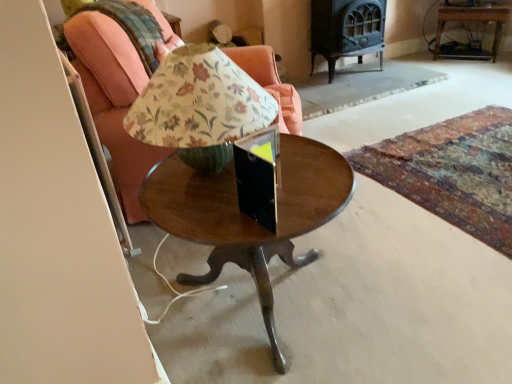
Question: Is wooden side table at upper right at the right side of wooden round table at center?

Choices:
 (A) yes
 (B) no

Answer: (A)

Question: Considering the relative sizes of wooden side table at upper right and wooden round table at center in the image provided, is wooden side table at upper right taller than wooden round table at center?

Choices:
 (A) no
 (B) yes

Answer: (A)

Question: Does wooden side table at upper right have a larger size compared to wooden round table at center?

Choices:
 (A) no
 (B) yes

Answer: (A)

Question: Is wooden round table at center surrounded by wooden side table at upper right?

Choices:
 (A) no
 (B) yes

Answer: (A)

Question: Is there a large distance between wooden side table at upper right and wooden round table at center?

Choices:
 (A) yes
 (B) no

Answer: (A)

Question: Would you say wooden round table at center is inside or outside wooden side table at upper right?

Choices:
 (A) inside
 (B) outside

Answer: (B)

Question: Considering the positions of wooden round table at center and wooden side table at upper right in the image, is wooden round table at center taller or shorter than wooden side table at upper right?

Choices:
 (A) tall
 (B) short

Answer: (A)

Question: Relative to wooden side table at upper right, is wooden round table at center in front or behind?

Choices:
 (A) behind
 (B) front

Answer: (B)

Question: From the image's perspective, is wooden round table at center above or below wooden side table at upper right?

Choices:
 (A) below
 (B) above

Answer: (A)

Question: Considering the positions of point (243, 228) and point (138, 210), is point (243, 228) closer or farther from the camera than point (138, 210)?

Choices:
 (A) farther
 (B) closer

Answer: (B)

Question: From the image's perspective, relative to matte wood chair at center, is wooden round table at center above or below?

Choices:
 (A) above
 (B) below

Answer: (B)

Question: From a real-world perspective, is wooden round table at center positioned above or below matte wood chair at center?

Choices:
 (A) above
 (B) below

Answer: (B)

Question: Considering the positions of wooden round table at center and matte wood chair at center in the image, is wooden round table at center wider or thinner than matte wood chair at center?

Choices:
 (A) thin
 (B) wide

Answer: (A)

Question: Based on their positions, is wooden side table at upper right located to the left or right of matte wood chair at center?

Choices:
 (A) left
 (B) right

Answer: (B)

Question: From the image's perspective, is wooden side table at upper right positioned above or below matte wood chair at center?

Choices:
 (A) below
 (B) above

Answer: (B)